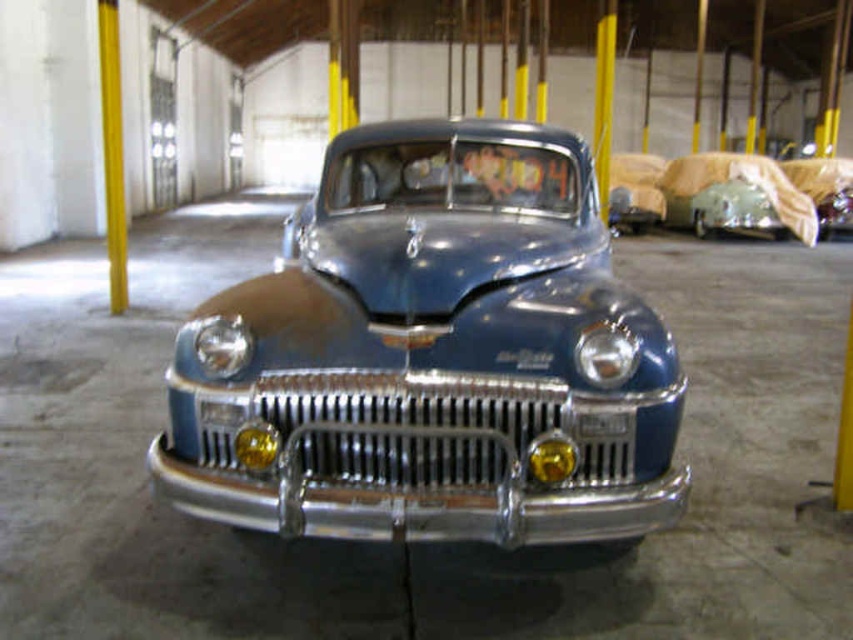
You are a photographer planning to take a picture of the metallic blue car at center and the yellow polished metal pole at left. If you want to ensure both objects are fully visible in the frame, which object should you position closer to the camera?

You should position the metallic blue car at center closer to the camera because it is in front of the yellow polished metal pole at left, so placing it nearer ensures both are visible without one blocking the other.

You are a photographer planning to take a photo of the metallic blue car at center and the yellow polished metal pole at left. Which object will appear taller in the photo?

The metallic blue car at center has a lesser height compared to the yellow polished metal pole at left, so the yellow polished metal pole at left will appear taller in the photo.

You are a mechanic working in the warehouse and need to move the metallic blue car at center to the north side of the garage. Given the current position coordinates, can you determine if the car is already positioned north of the garage?

The metallic blue car at center is located at point coordinates that are not north of the garage. The coordinates provided do not indicate a northern position, so the car needs to be moved to the north side.